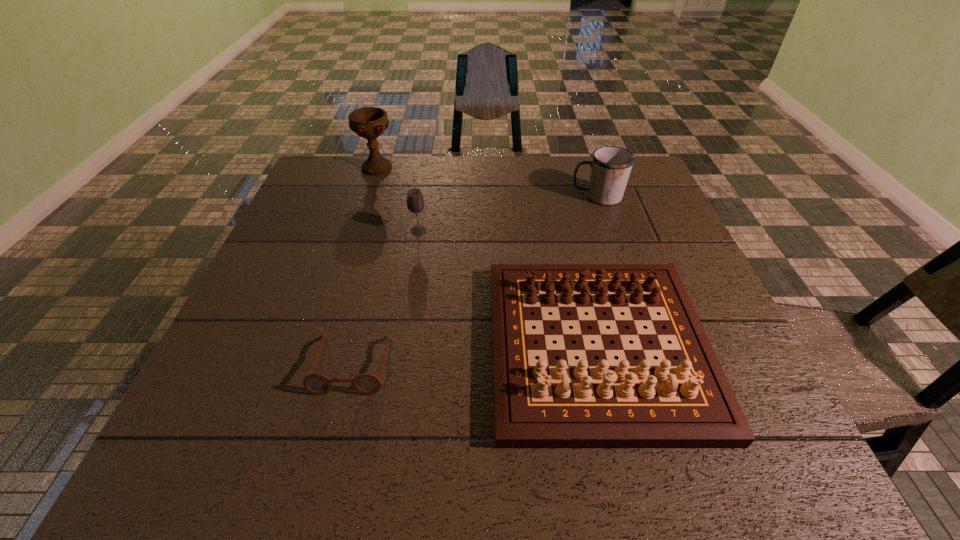
You are a GUI agent. You are given a task and a screenshot of the screen. Output one action in this format:
    pyautogui.click(x=<x>, y=<y>)
    Task: Click on the chalice
    
    Given the screenshot: What is the action you would take?
    pyautogui.click(x=368, y=122)

The height and width of the screenshot is (540, 960). Identify the location of the farthest object. (368, 122).

You are a GUI agent. You are given a task and a screenshot of the screen. Output one action in this format:
    pyautogui.click(x=<x>, y=<y>)
    Task: Click on the mug
    The width and height of the screenshot is (960, 540).
    Given the screenshot: What is the action you would take?
    pos(610,167)

Locate an element on the screen. glass drink container is located at coordinates (415, 202).

The width and height of the screenshot is (960, 540). Find the location of `the second shortest object`. the second shortest object is located at coordinates (686, 403).

This screenshot has width=960, height=540. Find the location of `spectacles`. spectacles is located at coordinates (365, 383).

Where is `blank area located on the right of the chalice`? The image size is (960, 540). blank area located on the right of the chalice is located at coordinates (471, 168).

The height and width of the screenshot is (540, 960). What are the coordinates of `blank area located on the handle side of the mug` in the screenshot? It's located at (540, 197).

Locate an element on the screen. The width and height of the screenshot is (960, 540). vacant area located on the handle side of the mug is located at coordinates (471, 197).

Where is `vacant space situated on the handle side of the mug`? The height and width of the screenshot is (540, 960). vacant space situated on the handle side of the mug is located at coordinates (x=444, y=197).